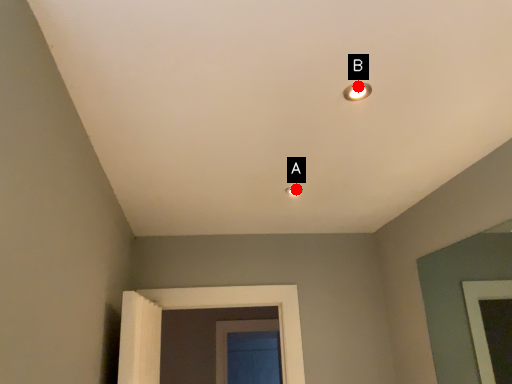
Question: Two points are circled on the image, labeled by A and B beside each circle. Which point appears farthest from the camera in this image?

Choices:
 (A) A is further
 (B) B is further

Answer: (A)